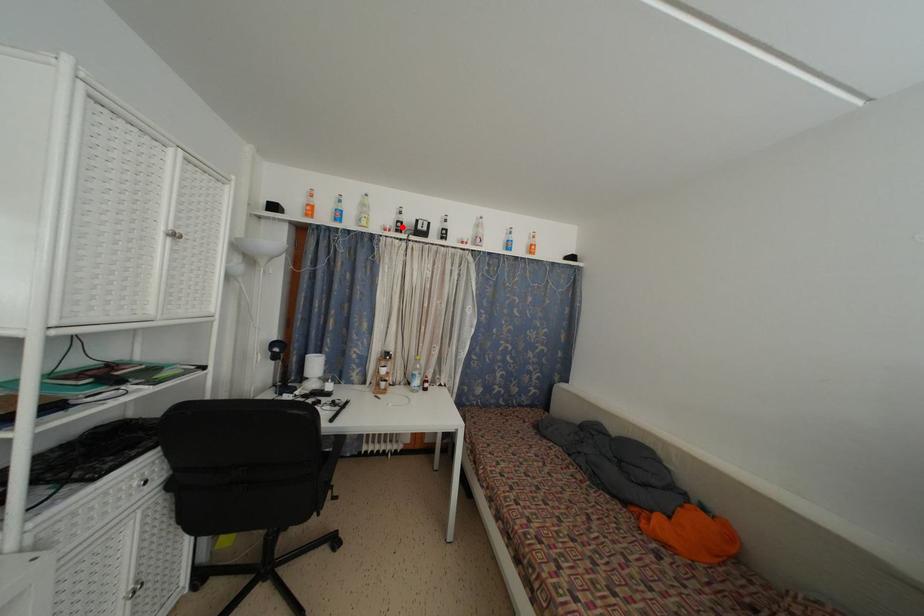
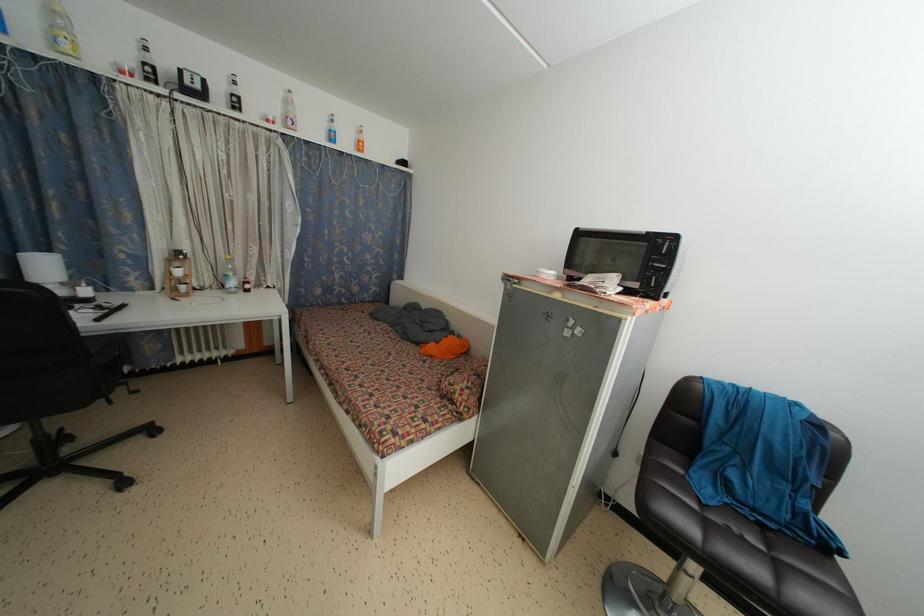
Question: I am providing you with two images of the same scene from different viewpoints. A red point is shown in image1. For the corresponding object point in image2, is it positioned nearer or farther from the camera?

Choices:
 (A) Nearer
 (B) Farther

Answer: (B)